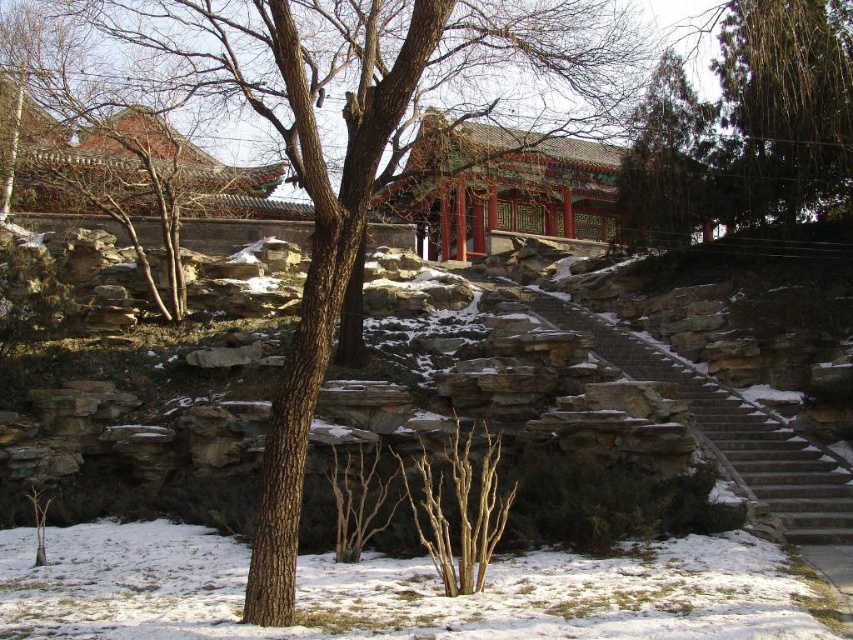
Question: Which object is closer to the camera taking this photo?

Choices:
 (A) green textured tree at upper right
 (B) green textured pine tree at upper right
 (C) bare wood at center

Answer: (C)

Question: Considering the relative positions of green textured pine tree at upper right and bare wood at center in the image provided, where is green textured pine tree at upper right located with respect to bare wood at center?

Choices:
 (A) left
 (B) right

Answer: (B)

Question: Where is green textured tree at upper right located in relation to green textured pine tree at upper right in the image?

Choices:
 (A) above
 (B) below

Answer: (A)

Question: Among these points, which one is nearest to the camera?

Choices:
 (A) (434, 552)
 (B) (770, 88)
 (C) (808, 531)
 (D) (648, 125)

Answer: (A)

Question: Observing the image, what is the correct spatial positioning of brown stone stairs at center in reference to bare wood at center?

Choices:
 (A) left
 (B) right

Answer: (B)

Question: Which point is closer to the camera?

Choices:
 (A) (828, 528)
 (B) (654, 240)

Answer: (A)